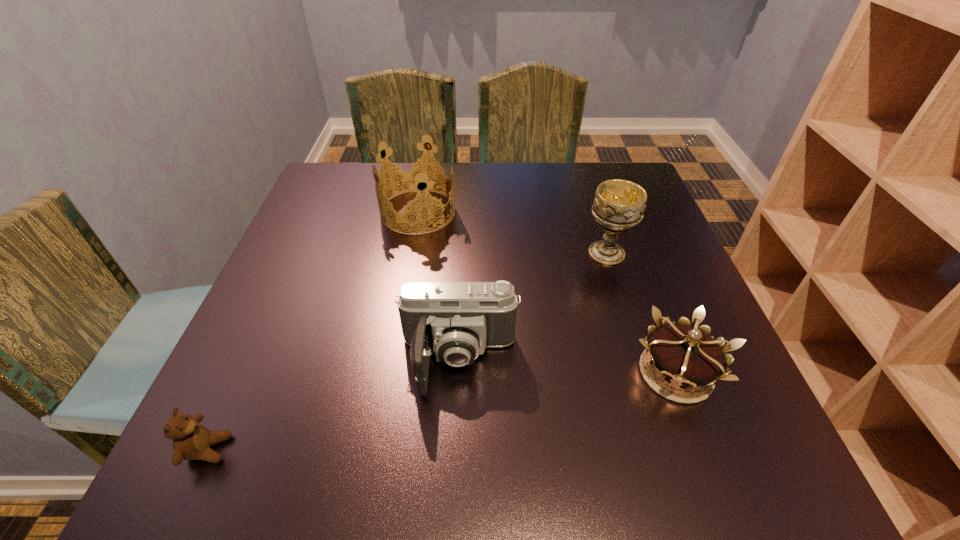
Where is `free space located at the front of the third tallest object with an open lens cover`? The image size is (960, 540). free space located at the front of the third tallest object with an open lens cover is located at coordinates (454, 471).

Where is `free location located 0.070m on the left of the right crown`? The width and height of the screenshot is (960, 540). free location located 0.070m on the left of the right crown is located at coordinates (587, 373).

You are a GUI agent. You are given a task and a screenshot of the screen. Output one action in this format:
    pyautogui.click(x=<x>, y=<y>)
    Task: Click on the free space located at the face of the leftmost object
    The width and height of the screenshot is (960, 540).
    Given the screenshot: What is the action you would take?
    pyautogui.click(x=338, y=449)

The height and width of the screenshot is (540, 960). I want to click on object present at the far edge, so click(x=413, y=174).

The height and width of the screenshot is (540, 960). What are the coordinates of `object at the near edge` in the screenshot? It's located at (191, 440).

At what (x,y) coordinates should I click in order to perform the action: click on object located at the left edge. Please return your answer as a coordinate pair (x, y). The image size is (960, 540). Looking at the image, I should click on (191, 440).

At what (x,y) coordinates should I click in order to perform the action: click on chalice that is at the right edge. Please return your answer as a coordinate pair (x, y). Image resolution: width=960 pixels, height=540 pixels. Looking at the image, I should click on coord(618,206).

At what (x,y) coordinates should I click in order to perform the action: click on crown present at the right edge. Please return your answer as a coordinate pair (x, y). The height and width of the screenshot is (540, 960). Looking at the image, I should click on (685, 355).

Locate an element on the screen. object that is at the near left corner is located at coordinates (191, 440).

The height and width of the screenshot is (540, 960). Find the location of `vacant space at the far edge`. vacant space at the far edge is located at coordinates (375, 207).